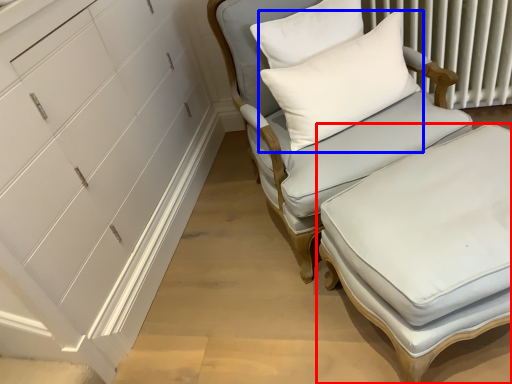
Question: Which object appears closest to the camera in this image, table (highlighted by a red box) or pillow (highlighted by a blue box)?

Choices:
 (A) table
 (B) pillow

Answer: (A)